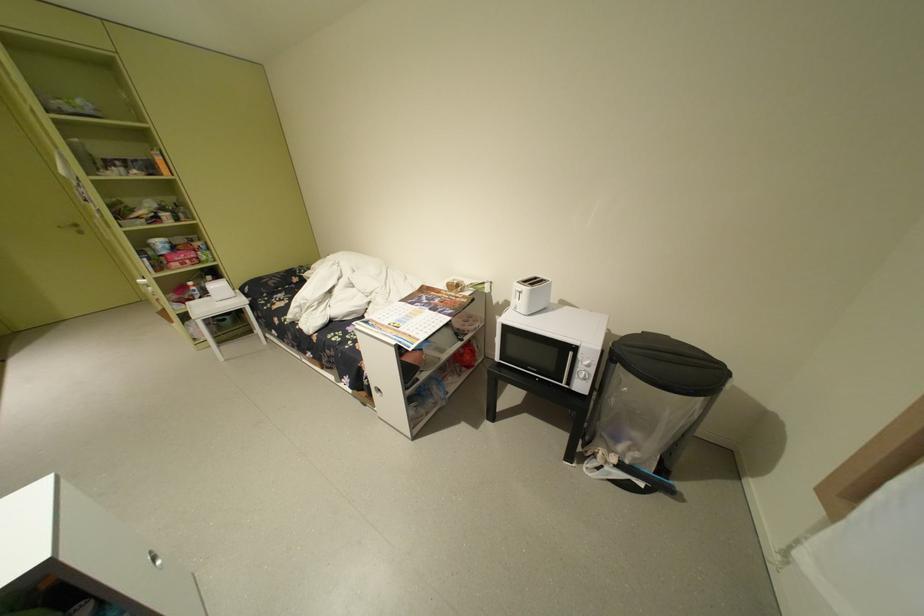
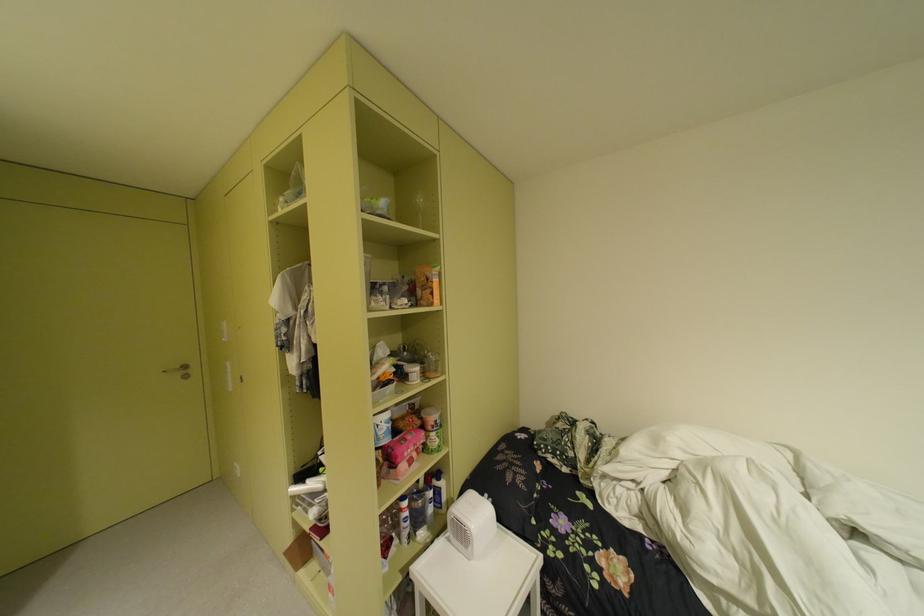
What movement of the cameraman would produce the second image?

The cameraman moved toward left, forward.